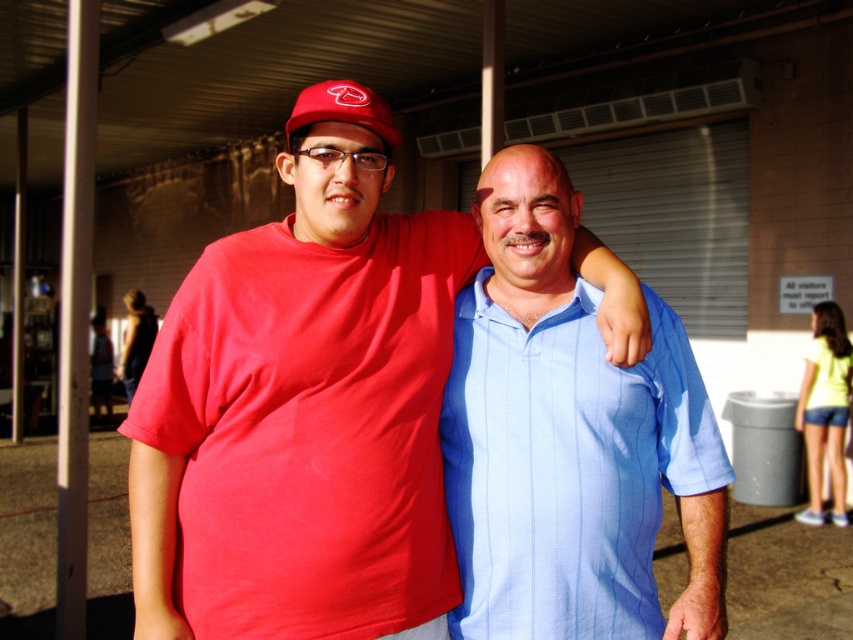
Question: Among these objects, which one is nearest to the camera?

Choices:
 (A) blue striped shirt at center
 (B) matte red baseball cap at upper center
 (C) matte red shirt at center

Answer: (C)

Question: Which is nearer to the blue striped shirt at center?

Choices:
 (A) matte red baseball cap at upper center
 (B) matte red shirt at center

Answer: (B)

Question: Does blue striped shirt at center have a larger size compared to matte red baseball cap at upper center?

Choices:
 (A) yes
 (B) no

Answer: (A)

Question: Does matte red shirt at center have a larger size compared to blue striped shirt at center?

Choices:
 (A) no
 (B) yes

Answer: (B)

Question: Which point appears farthest from the camera in this image?

Choices:
 (A) (291, 109)
 (B) (537, 461)
 (C) (363, 328)

Answer: (A)

Question: Is matte red shirt at center above matte red baseball cap at upper center?

Choices:
 (A) no
 (B) yes

Answer: (A)